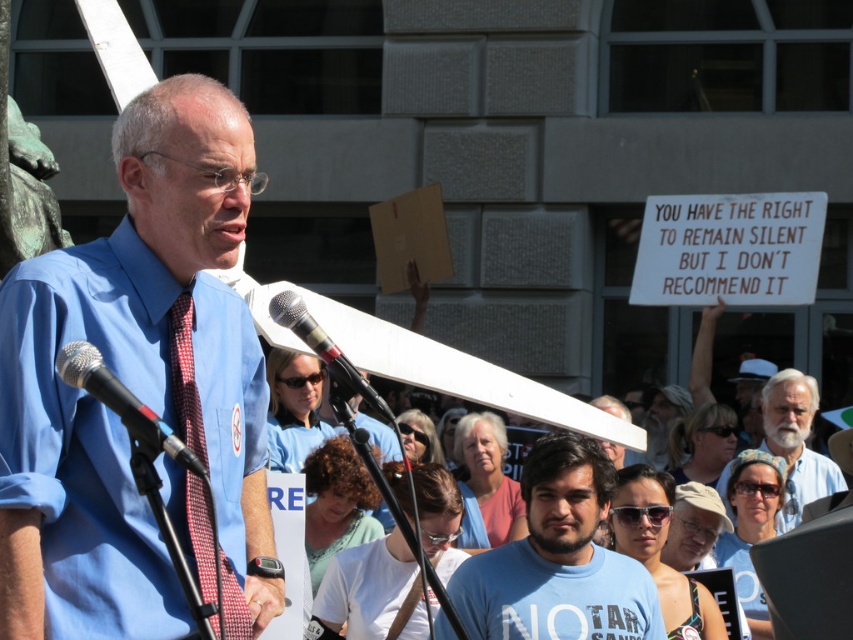
You are a photographer at the event and want to capture a closeup shot of the speaker. Which object, the white beard at center or the silver metallic microphone at center, would appear smaller in the photo?

The white beard at center occupies less space than the silver metallic microphone at center, so it would appear smaller in the photo.